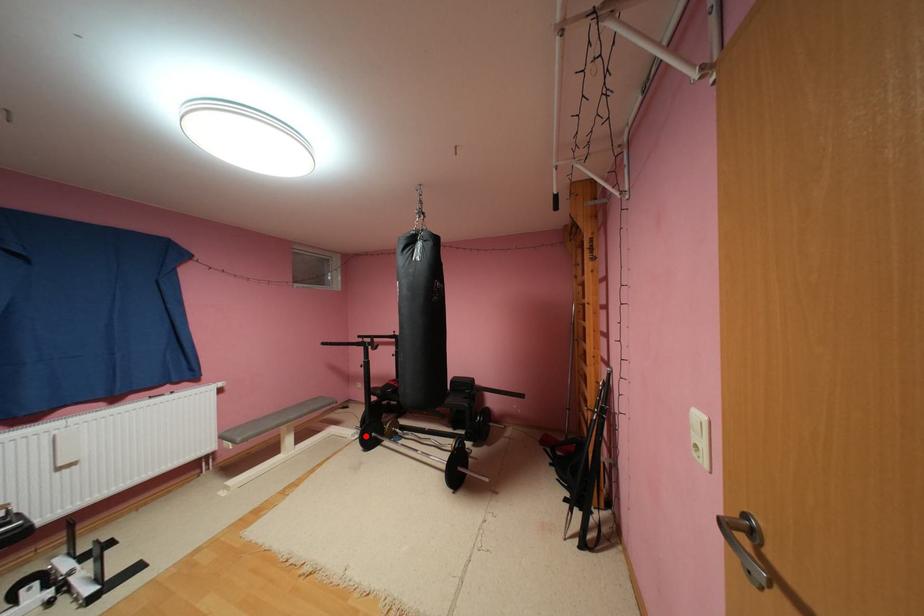
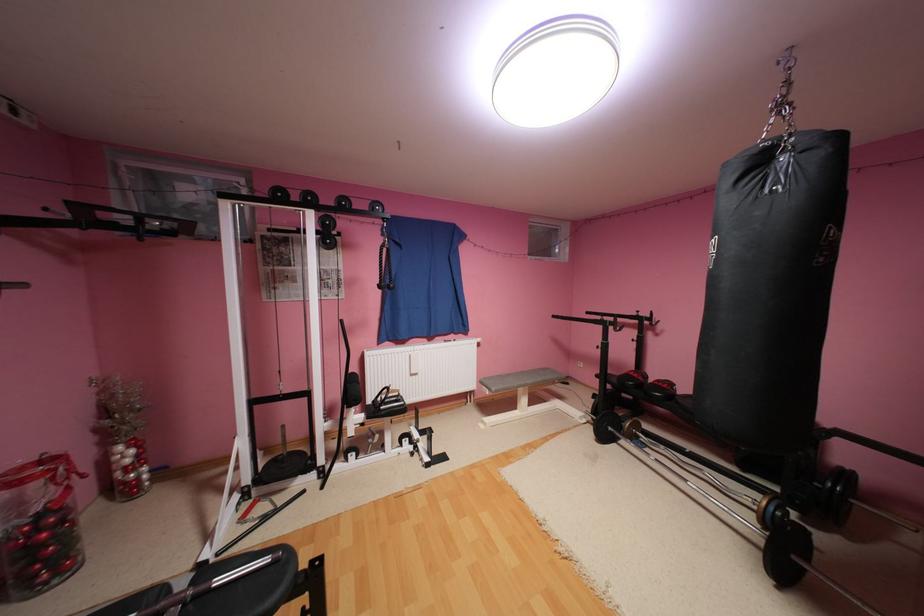
Find the pixel in the second image that matches the highlighted location in the first image.

(593, 419)